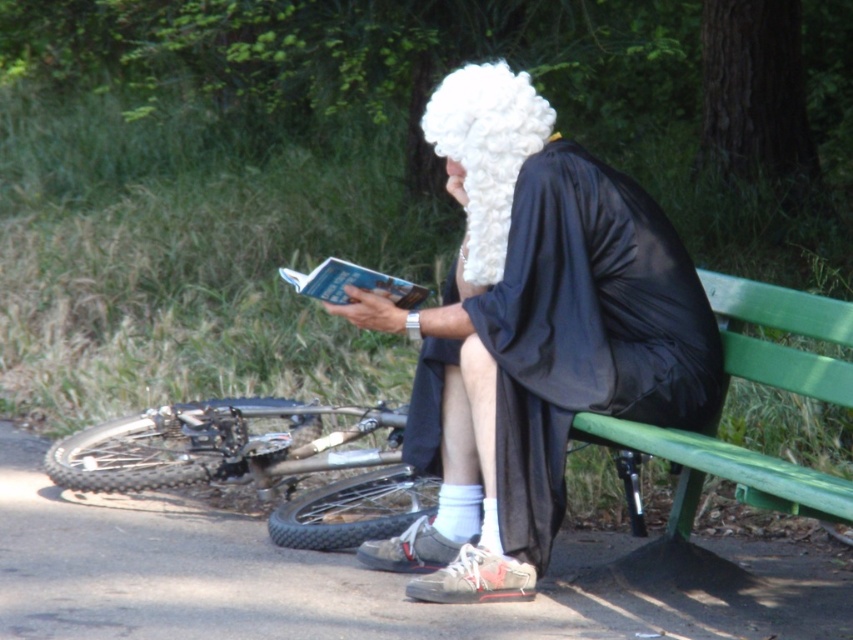
Question: Which object is the closest to the green painted wood bench at lower right?

Choices:
 (A) white fluffy wig at center
 (B) shiny metallic bicycle at lower left
 (C) black satin robe at center

Answer: (C)

Question: Is the position of shiny metallic bicycle at lower left less distant than that of white fluffy wig at center?

Choices:
 (A) no
 (B) yes

Answer: (A)

Question: Observing the image, what is the correct spatial positioning of black satin robe at center in reference to shiny metallic bicycle at lower left?

Choices:
 (A) above
 (B) below

Answer: (A)

Question: Is black satin robe at center further to camera compared to white fluffy wig at center?

Choices:
 (A) yes
 (B) no

Answer: (B)

Question: Which is nearer to the black satin robe at center?

Choices:
 (A) shiny metallic bicycle at lower left
 (B) white fluffy wig at center

Answer: (B)

Question: Which point is closer to the camera?

Choices:
 (A) (802, 378)
 (B) (334, 545)

Answer: (A)